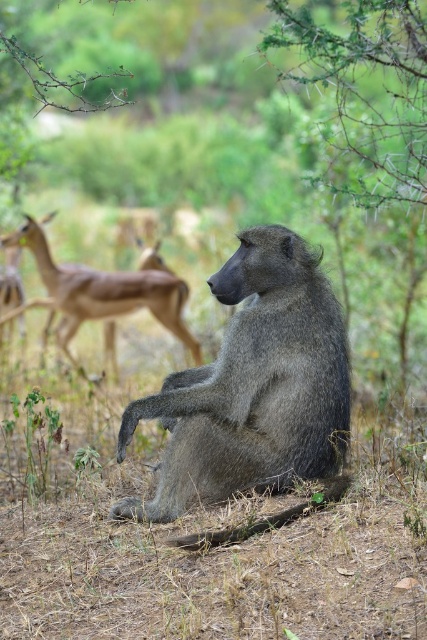
You are a photographer trying to capture the brown glossy antelope at left and the green spiny branch at upper right in the same frame. Which object should you move your camera towards to get both in focus?

The green spiny branch at upper right is positioned on the right side of brown glossy antelope at left, so you should move your camera towards the right side of the brown glossy antelope at left to include the green spiny branch at upper right in the frame.

You are a wildlife photographer aiming to capture a photo of the gray furry baboon at center and the brown glossy antelope at left. Based on their positions, which animal would be in the foreground of your photo?

The brown glossy antelope at left is in the foreground because the gray furry baboon at center is positioned under it, indicating the antelope is closer to the camera.